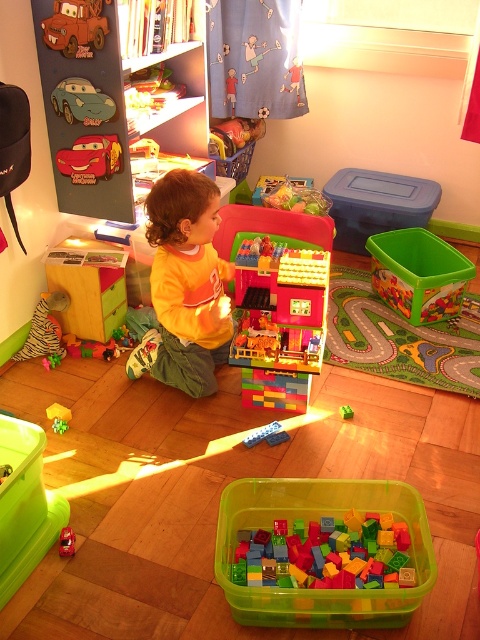
Between point (183, 195) and point (404, 557), which one is positioned behind?

Positioned behind is point (183, 195).

Does matte yellow shirt at center have a greater height compared to translucent plastic blocks at center?

Yes, matte yellow shirt at center is taller than translucent plastic blocks at center.

Does point (216, 312) lie in front of point (239, 579)?

No, it is behind (239, 579).

You are a GUI agent. You are given a task and a screenshot of the screen. Output one action in this format:
    pyautogui.click(x=<x>, y=<y>)
    Task: Click on the matte yellow shirt at center
    
    Given the screenshot: What is the action you would take?
    pyautogui.click(x=182, y=288)

Who is positioned more to the left, metallic red car at upper left or metallic red car at left?

metallic red car at left is more to the left.

I want to click on metallic red car at upper left, so click(x=75, y=26).

What do you see at coordinates (75, 26) in the screenshot?
I see `metallic red car at upper left` at bounding box center [75, 26].

Locate an element on the screen. metallic red car at upper left is located at coordinates (75, 26).

Between translucent plastic blocks at center and green matte block at center, which one appears on the left side from the viewer's perspective?

Positioned to the left is translucent plastic blocks at center.

This screenshot has height=640, width=480. I want to click on translucent plastic blocks at center, so click(x=326, y=554).